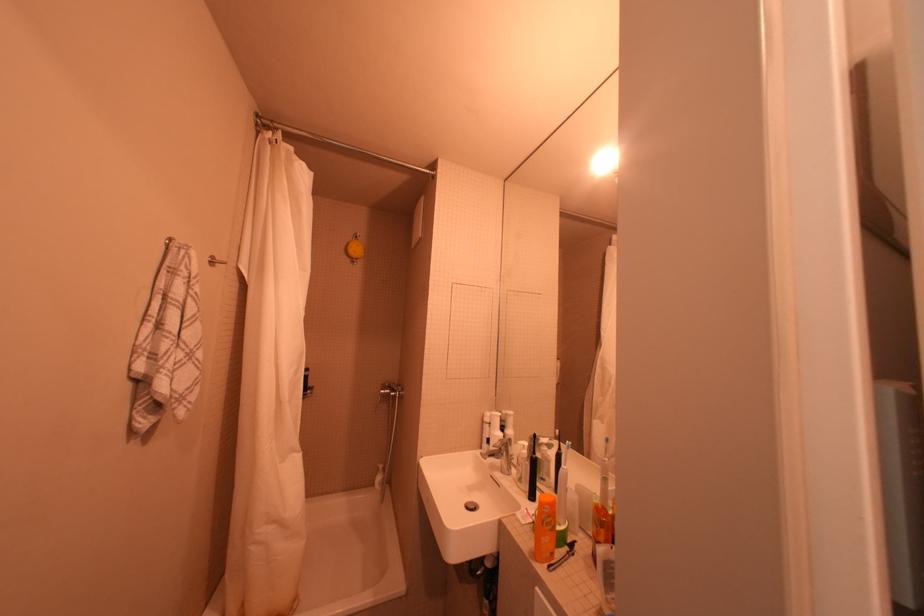
What are the coordinates of `bottle pump dispenser` in the screenshot? It's located at (544, 533).